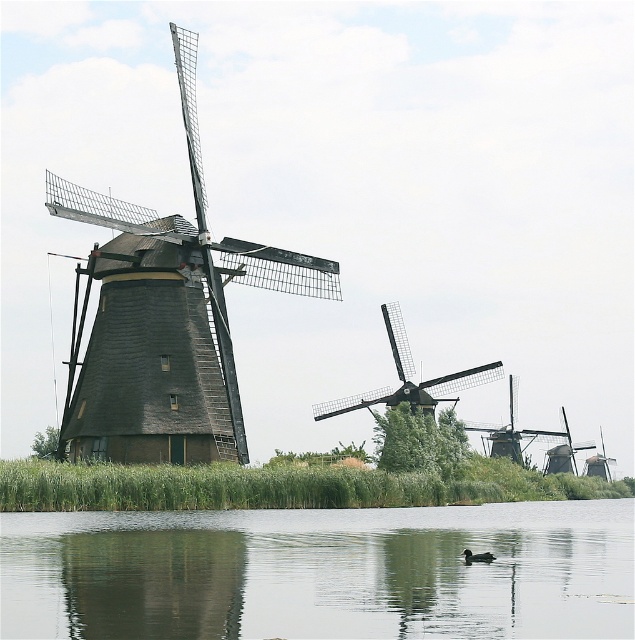
Between dark brown wooden windmill at center and brown feathered duck at lower center, which one appears on the right side from the viewer's perspective?

brown feathered duck at lower center

Who is positioned more to the left, dark brown wooden windmill at center or brown feathered duck at lower center?

dark brown wooden windmill at center

This screenshot has width=635, height=640. What do you see at coordinates (408, 378) in the screenshot?
I see `dark brown wooden windmill at center` at bounding box center [408, 378].

Find the location of a particular element. This screenshot has height=640, width=635. dark brown wooden windmill at center is located at coordinates (408, 378).

What do you see at coordinates (164, 317) in the screenshot? The image size is (635, 640). I see `dark gray wooden windmill at left` at bounding box center [164, 317].

Is point (211, 292) closer to camera compared to point (399, 330)?

Yes.

The image size is (635, 640). I want to click on dark gray wooden windmill at left, so click(164, 317).

Between transparent water at center and brown feathered duck at lower center, which one is positioned higher?

Positioned higher is brown feathered duck at lower center.

Does transparent water at center appear on the right side of brown feathered duck at lower center?

In fact, transparent water at center is to the left of brown feathered duck at lower center.

Is point (218, 579) positioned behind point (467, 554)?

No, it is not.

Where is `transparent water at center`? transparent water at center is located at coordinates (321, 572).